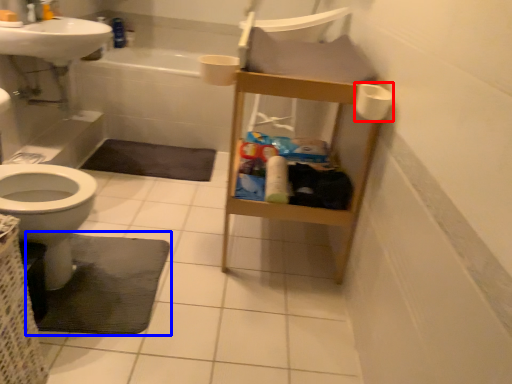
Question: Among these objects, which one is nearest to the camera, toilet paper (highlighted by a red box) or bath mat (highlighted by a blue box)?

Choices:
 (A) toilet paper
 (B) bath mat

Answer: (A)